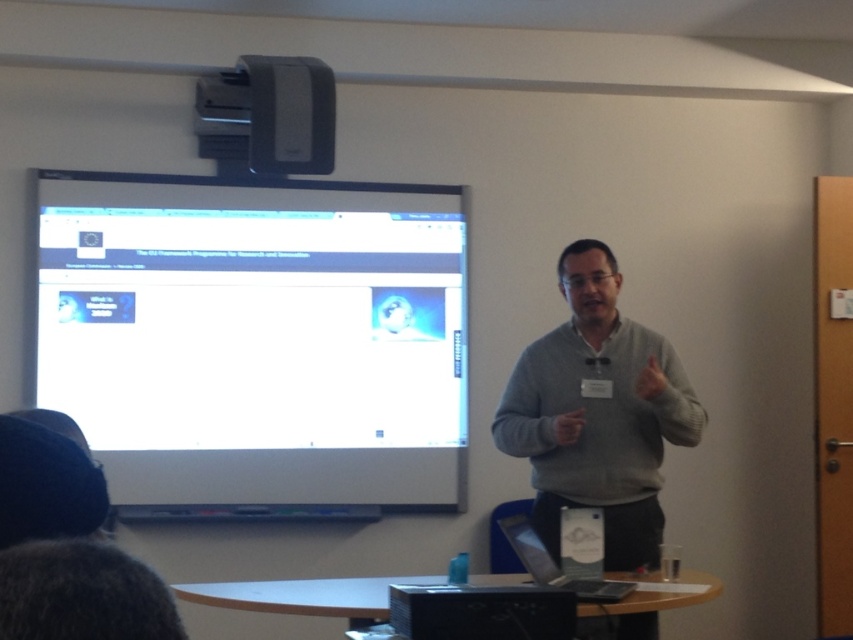
Can you confirm if gray sweater at center is smaller than matte gray projector at upper center?

Incorrect, gray sweater at center is not smaller in size than matte gray projector at upper center.

Is point (581, 412) less distant than point (260, 74)?

Yes, point (581, 412) is in front of point (260, 74).

This screenshot has width=853, height=640. In order to click on gray sweater at center in this screenshot , I will do `click(596, 413)`.

Which is above, white glossy projection screen at upper left or gray sweater at center?

white glossy projection screen at upper left is higher up.

Can you confirm if white glossy projection screen at upper left is positioned below gray sweater at center?

No, white glossy projection screen at upper left is not below gray sweater at center.

Locate an element on the screen. white glossy projection screen at upper left is located at coordinates (257, 337).

Find the location of a particular element. white glossy projection screen at upper left is located at coordinates (x=257, y=337).

Which is below, white glossy projection screen at upper left or matte gray projector at upper center?

white glossy projection screen at upper left

In the scene shown: Which is more to the right, white glossy projection screen at upper left or matte gray projector at upper center?

From the viewer's perspective, matte gray projector at upper center appears more on the right side.

Does point (180, 474) come farther from viewer compared to point (286, 84)?

That is True.

Identify the location of white glossy projection screen at upper left. The width and height of the screenshot is (853, 640). (257, 337).